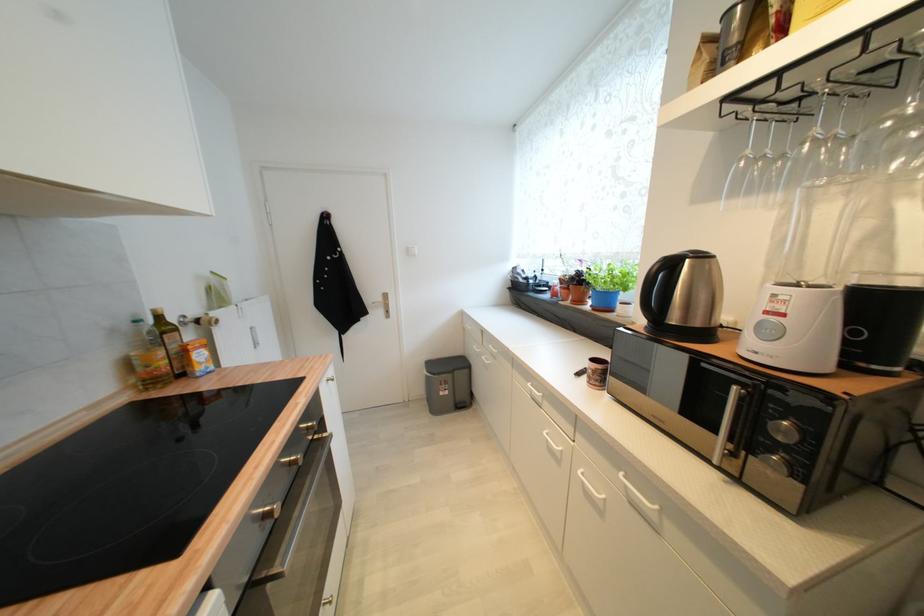
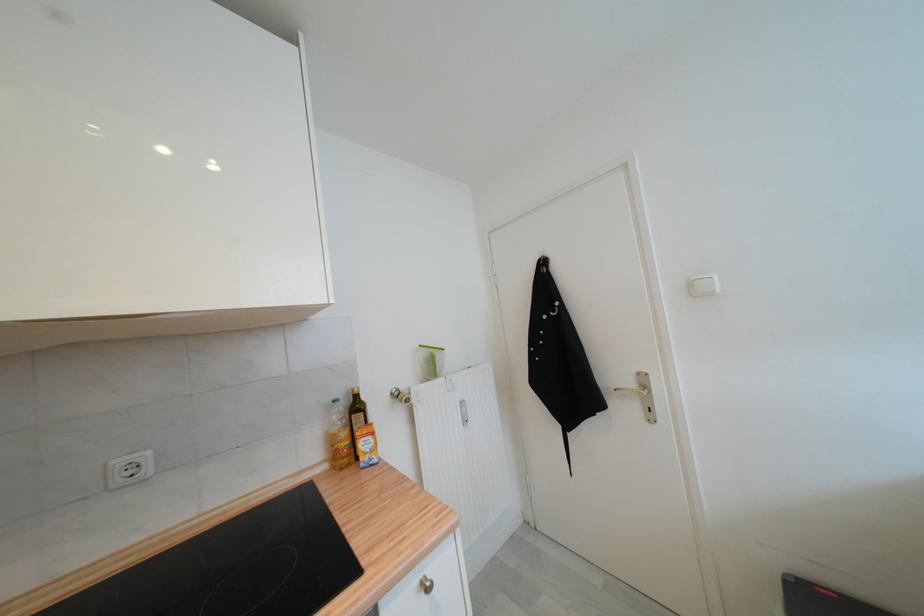
Where in the second image is the point corresponding to (x=141, y=323) from the first image?

(339, 403)